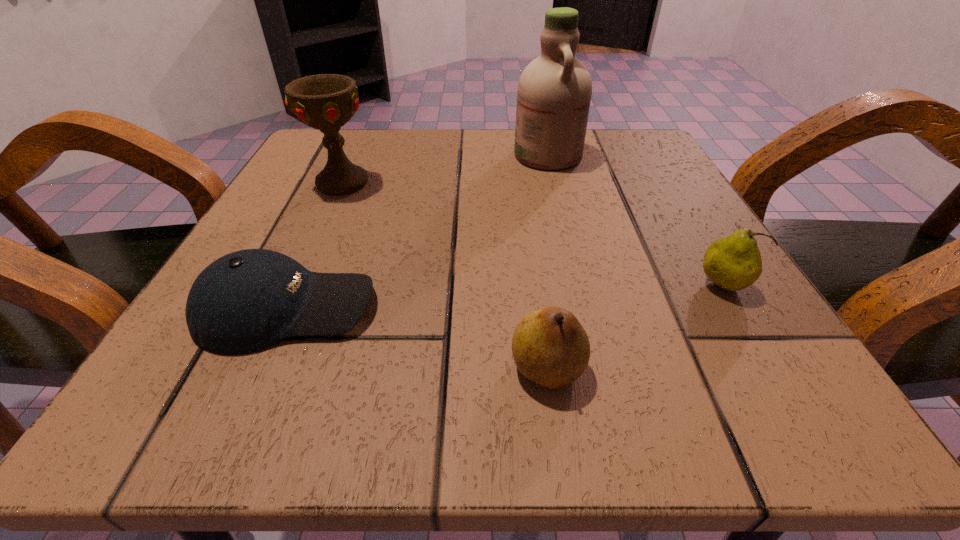
This screenshot has height=540, width=960. In order to click on object at the far left corner in this screenshot , I will do `click(326, 102)`.

You are a GUI agent. You are given a task and a screenshot of the screen. Output one action in this format:
    pyautogui.click(x=<x>, y=<y>)
    Task: Click on the object positioned at the far right corner
    The image size is (960, 540).
    Given the screenshot: What is the action you would take?
    point(554,92)

I want to click on vacant space at the far edge of the desktop, so click(x=409, y=134).

This screenshot has height=540, width=960. Find the location of `vacant space at the left edge of the desktop`. vacant space at the left edge of the desktop is located at coordinates (245, 244).

This screenshot has width=960, height=540. Find the location of `vacant area at the right edge`. vacant area at the right edge is located at coordinates (619, 230).

Where is `vacant space at the far left corner`? vacant space at the far left corner is located at coordinates (318, 138).

I want to click on free space at the near left corner, so click(190, 396).

The width and height of the screenshot is (960, 540). In the image, there is a desktop. Identify the location of vacant space at the far right corner. 624,165.

The image size is (960, 540). I want to click on vacant region at the near right corner, so click(688, 376).

Identify the location of unoccupied area between the chalice and the left pear. (445, 275).